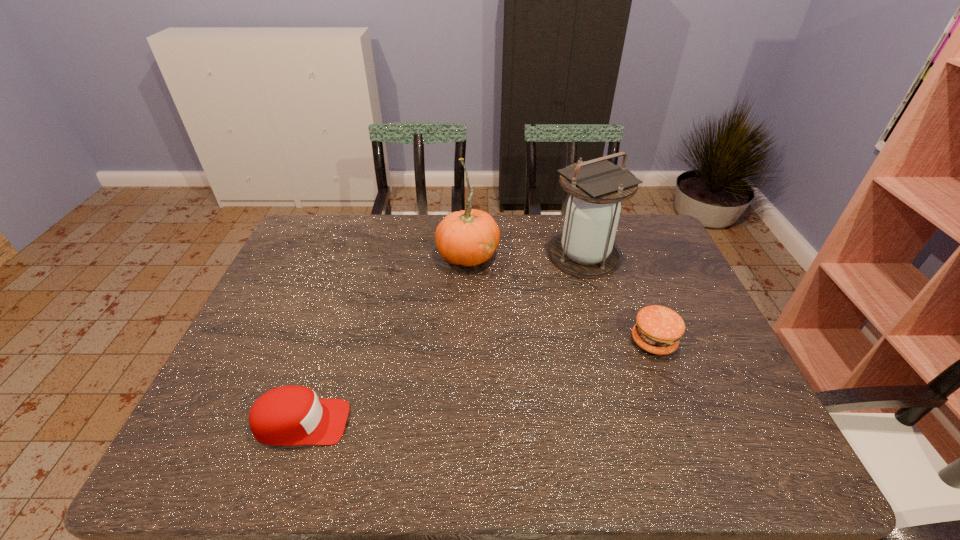
In order to click on lantern present at the far edge in this screenshot , I will do `click(597, 187)`.

Identify the location of pumpkin that is at the far edge. (468, 238).

Locate an element on the screen. This screenshot has height=540, width=960. object that is at the near edge is located at coordinates pos(289,415).

Locate an element on the screen. The width and height of the screenshot is (960, 540). object positioned at the left edge is located at coordinates (289, 415).

Where is `object that is at the right edge`? This screenshot has width=960, height=540. object that is at the right edge is located at coordinates (657, 330).

At what (x,y) coordinates should I click in order to perform the action: click on object located at the near left corner. Please return your answer as a coordinate pair (x, y). Looking at the image, I should click on (289, 415).

Locate an element on the screen. This screenshot has height=540, width=960. vacant space at the far edge is located at coordinates (554, 227).

Locate an element on the screen. This screenshot has width=960, height=540. free space at the near edge of the desktop is located at coordinates (690, 443).

Identify the location of vacant space at the left edge of the desktop. (278, 291).

Image resolution: width=960 pixels, height=540 pixels. What are the coordinates of `blank space at the right edge of the desktop` in the screenshot? It's located at (677, 279).